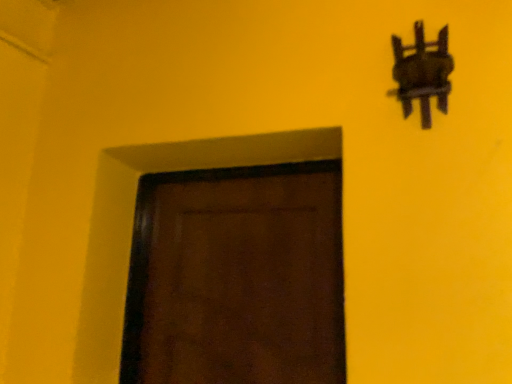
The image size is (512, 384). Describe the element at coordinates (237, 277) in the screenshot. I see `brown matte door at center` at that location.

Image resolution: width=512 pixels, height=384 pixels. What are the coordinates of `brown matte door at center` in the screenshot? It's located at (237, 277).

This screenshot has width=512, height=384. What are the coordinates of `brown matte door at center` in the screenshot? It's located at (237, 277).